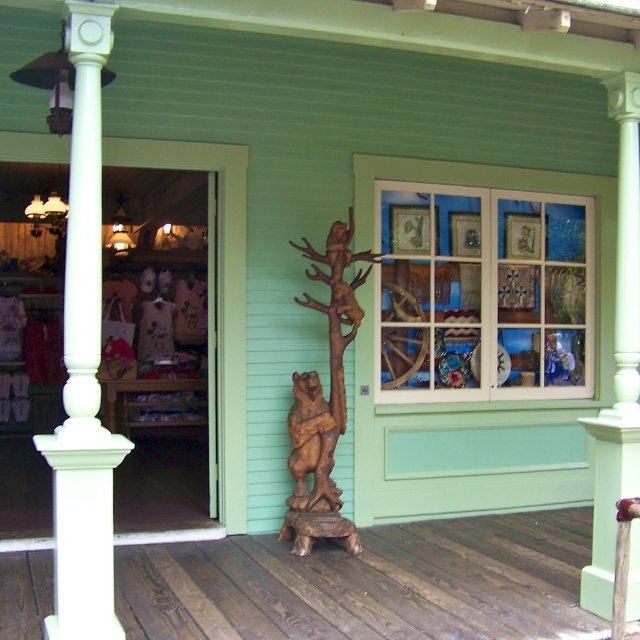
Question: Is matte glass window at center positioned before brown wood bear at center?

Choices:
 (A) yes
 (B) no

Answer: (B)

Question: Which of the following is the closest to the observer?

Choices:
 (A) white painted wood column at left
 (B) matte glass window at center

Answer: (A)

Question: Can you confirm if white painted wood column at left is positioned to the right of white painted wood column at center?

Choices:
 (A) no
 (B) yes

Answer: (A)

Question: Does white painted wood column at left have a larger size compared to brown wood bear at center?

Choices:
 (A) yes
 (B) no

Answer: (A)

Question: Which point is farther from the camera taking this photo?

Choices:
 (A) (316, 561)
 (B) (74, 374)
 (C) (493, 356)

Answer: (C)

Question: Which point is closer to the camera?

Choices:
 (A) white painted wood column at center
 (B) wooden bench at center

Answer: (B)